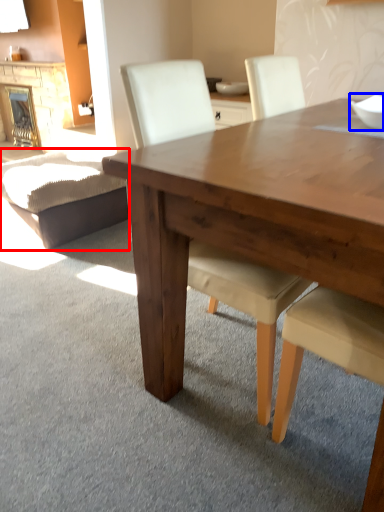
Question: Which of the following is the closest to the observer, swivel chair (highlighted by a red box) or bowl (highlighted by a blue box)?

Choices:
 (A) swivel chair
 (B) bowl

Answer: (B)